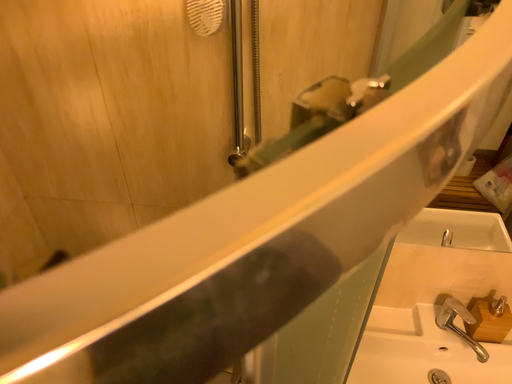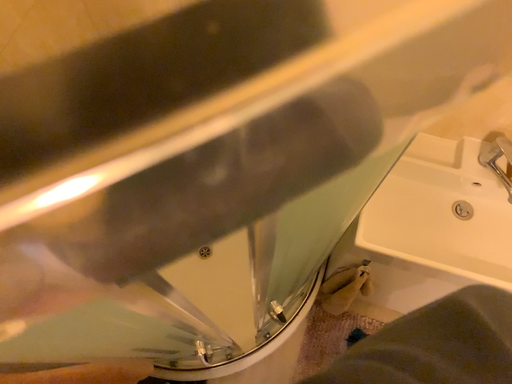
Question: How did the camera likely rotate when shooting the video?

Choices:
 (A) rotated downward
 (B) rotated upward

Answer: (A)